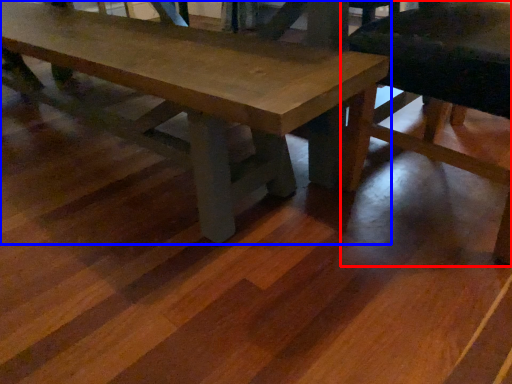
Question: Which point is further to the camera, chair (highlighted by a red box) or table (highlighted by a blue box)?

Choices:
 (A) chair
 (B) table

Answer: (B)